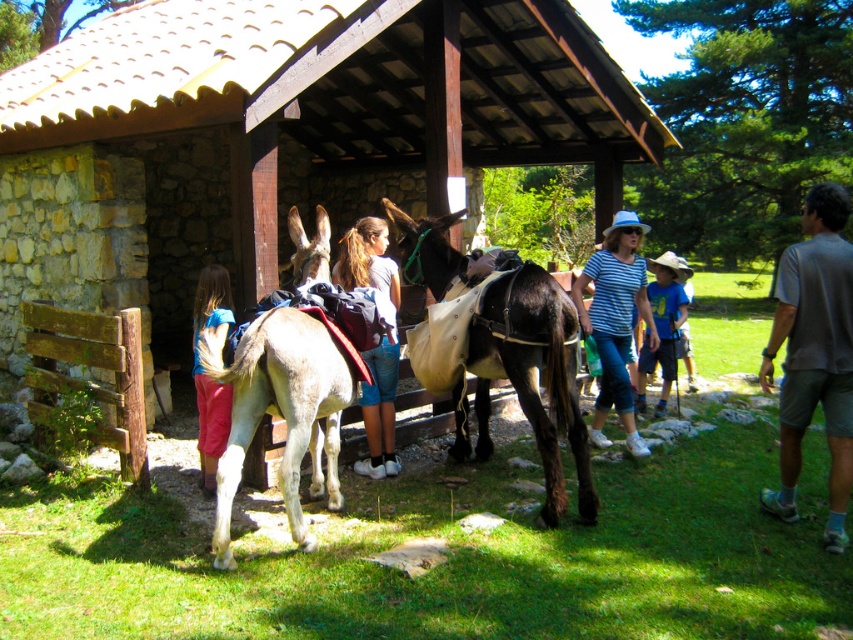
Can you confirm if white matte mule at center is positioned to the right of gray fabric shirt at right?

No, white matte mule at center is not to the right of gray fabric shirt at right.

How distant is white matte mule at center from gray fabric shirt at right?

white matte mule at center is 3.59 meters from gray fabric shirt at right.

Where is `white matte mule at center`? white matte mule at center is located at coordinates (281, 410).

Does dark brown leather mule at center have a greater height compared to denim shorts at center?

In fact, dark brown leather mule at center may be shorter than denim shorts at center.

Can you confirm if dark brown leather mule at center is positioned above denim shorts at center?

Actually, dark brown leather mule at center is below denim shorts at center.

Is point (479, 412) closer to viewer compared to point (372, 252)?

That is False.

You are a GUI agent. You are given a task and a screenshot of the screen. Output one action in this format:
    pyautogui.click(x=<x>, y=<y>)
    Task: Click on the dark brown leather mule at center
    This screenshot has height=640, width=853.
    Given the screenshot: What is the action you would take?
    pyautogui.click(x=532, y=376)

This screenshot has width=853, height=640. What do you see at coordinates (614, 321) in the screenshot?
I see `striped cotton shirt at center` at bounding box center [614, 321].

Between point (625, 426) and point (363, 253), which one is positioned in front?

Point (363, 253) is in front.

The width and height of the screenshot is (853, 640). Find the location of `striped cotton shirt at center`. striped cotton shirt at center is located at coordinates (614, 321).